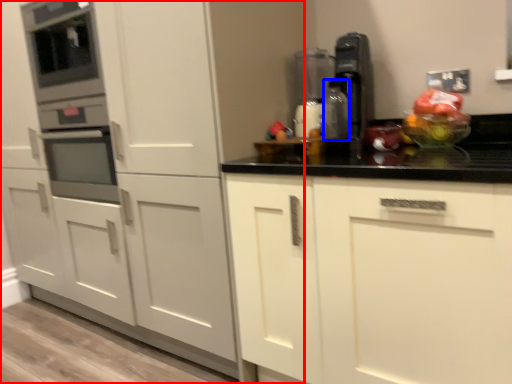
Question: Which of the following is the farthest to the observer, cabinetry (highlighted by a red box) or bottle (highlighted by a blue box)?

Choices:
 (A) cabinetry
 (B) bottle

Answer: (B)